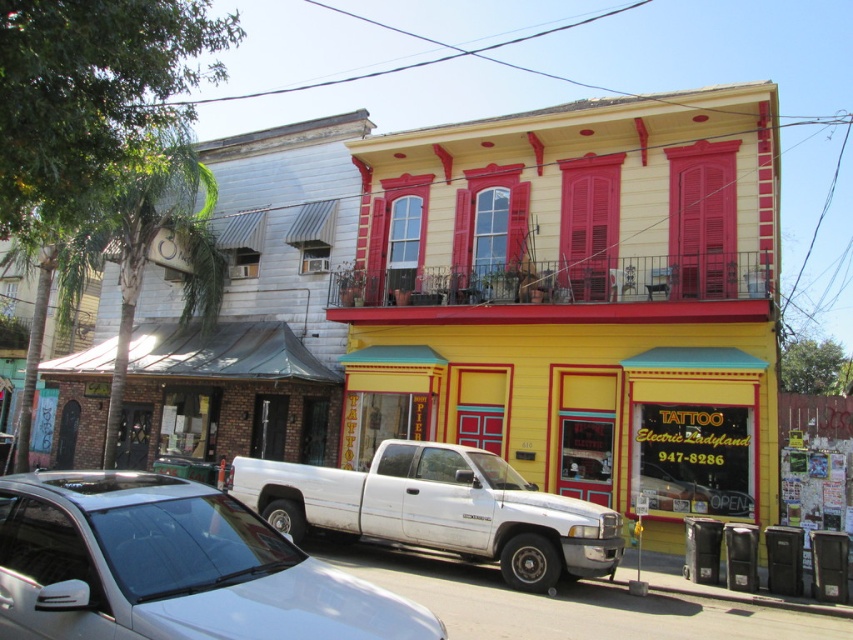
Can you confirm if matte wood shutter at upper right is wider than red matte shutter at upper center?

No, matte wood shutter at upper right is not wider than red matte shutter at upper center.

Which is behind, point (701, 180) or point (606, 216)?

The point (606, 216) is behind.

Is point (715, 205) closer to camera compared to point (573, 280)?

Yes, it is.

Find the location of a particular element. matte wood shutter at upper right is located at coordinates (701, 220).

Which is more to the right, yellow matte building at center or white matte truck at center?

yellow matte building at center is more to the right.

Describe the element at coordinates (577, 301) in the screenshot. I see `yellow matte building at center` at that location.

Where is `yellow matte building at center`? The height and width of the screenshot is (640, 853). yellow matte building at center is located at coordinates (577, 301).

Does white matte truck at center have a lesser height compared to matte wood shutter at upper right?

Correct, white matte truck at center is not as tall as matte wood shutter at upper right.

Is white matte truck at center to the right of matte wood shutter at upper right from the viewer's perspective?

In fact, white matte truck at center is to the left of matte wood shutter at upper right.

Is point (131, 476) farther from camera compared to point (726, 168)?

No.

I want to click on white matte truck at center, so click(x=171, y=566).